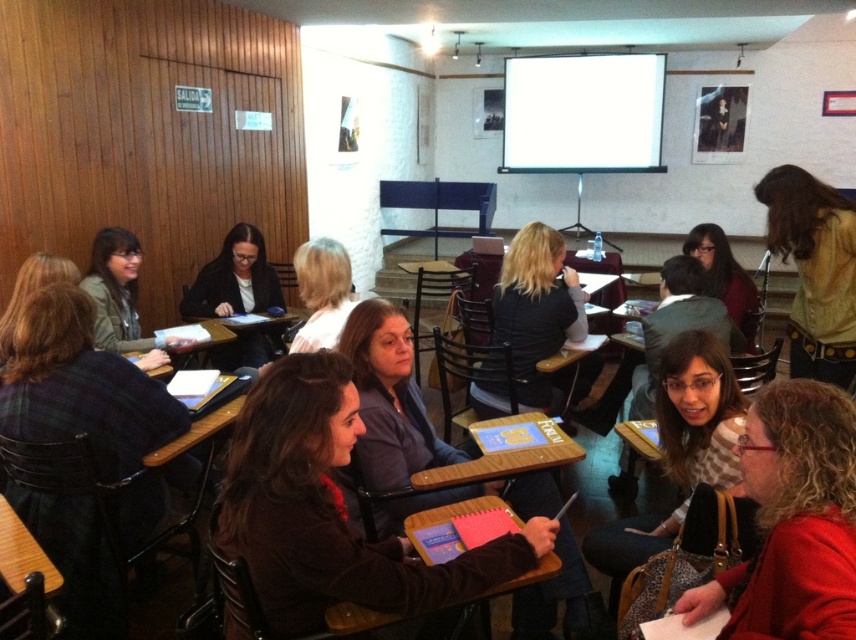
You are a student sitting at the back of the classroom. You notice two people in front of you wearing a dark brown sweater at center and a matte green jacket at left. Which person is closer to the projection screen mounted at the back of the room?

The dark brown sweater at center is taller than the matte green jacket at left, so the person wearing the dark brown sweater at center is closer to the projection screen mounted at the back of the room because they are taller and would be seated closer to the back.

From the picture: You are standing at the back of the classroom facing the projection screen. You notice two points marked on the wall in front of you. One is at coordinate point (286, 627) and the other is at point (528, 304). If you want to touch the point that is nearer to you, which coordinate should you reach for?

You should reach for point (286, 627) because it is closer to you than point (528, 304).

You are standing at the entrance of the classroom and want to locate the dark brown sweater at center. Based on the coordinates provided, can you determine its position relative to the classroom entrance?

The dark brown sweater at center is located at coordinates approximately 0.8 in the x direction and 0.4 in the y direction. Since the entrance is typically at the front of the classroom facing the screen, the sweater is positioned towards the back of the room.